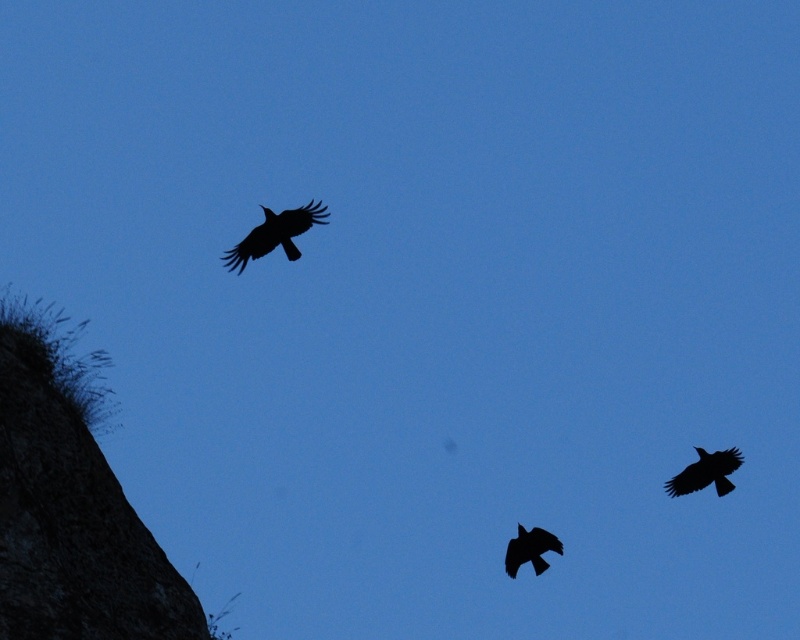
Looking at this image, you are an ornithologist observing two black matte ravens in the sky. You notice their positions and sizes in the image. Which raven, the black matte raven at upper right or the black matte raven at lower center, appears smaller in height?

The black matte raven at upper right has a lesser height compared to the black matte raven at lower center, so it appears smaller in height.

You are a photographer standing in the lower left corner of the image, aiming to capture the black matte raven at upper right. You notice a point marked at coordinates point (706, 472). Can you determine if this point is the correct location for the raven?

The point (706, 472) marks the black matte raven at upper right, so yes, this point is correctly located at the upper right corner of the image where the raven is positioned.